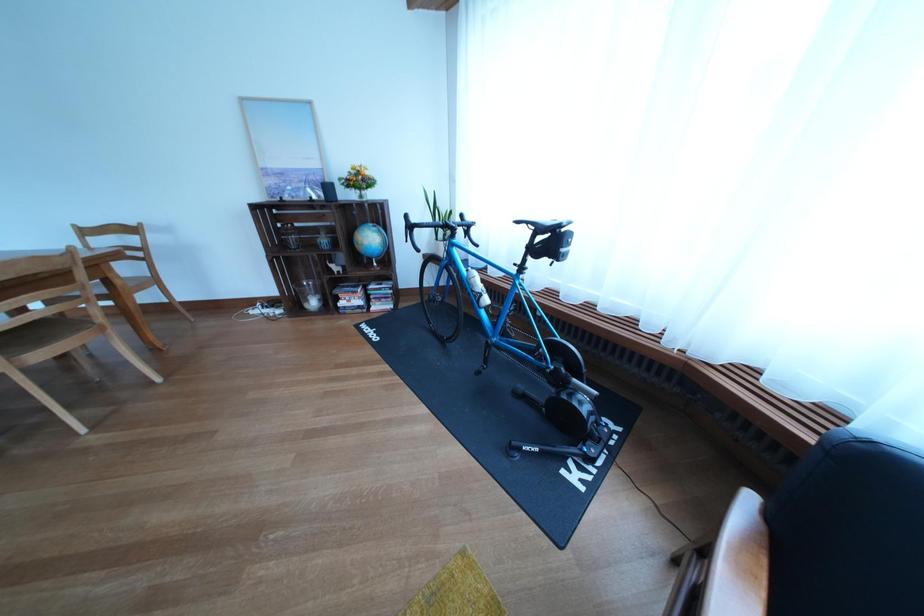
Which object does [371,241] point to?

This point indicates the small blue globe.